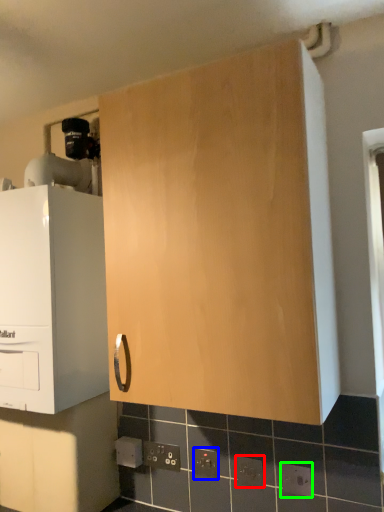
Question: Which is farther away from electric outlet (highlighted by a red box)? electric outlet (highlighted by a blue box) or electric outlet (highlighted by a green box)?

Choices:
 (A) electric outlet
 (B) electric outlet

Answer: (A)